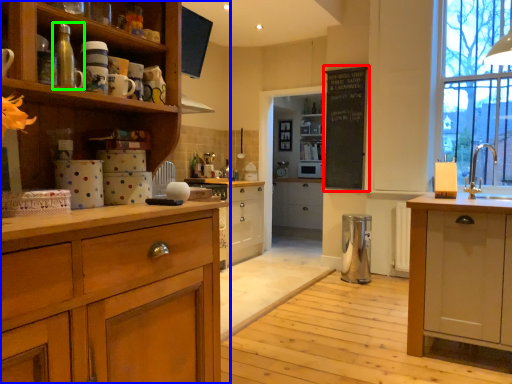
Question: Which is farther away from bulletin board (highlighted by a red box)? cupboard (highlighted by a blue box) or appliance (highlighted by a green box)?

Choices:
 (A) cupboard
 (B) appliance

Answer: (B)